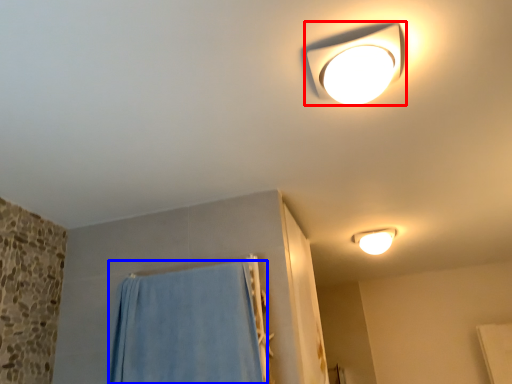
Question: Among these objects, which one is nearest to the camera, lamp (highlighted by a red box) or curtain (highlighted by a blue box)?

Choices:
 (A) lamp
 (B) curtain

Answer: (A)